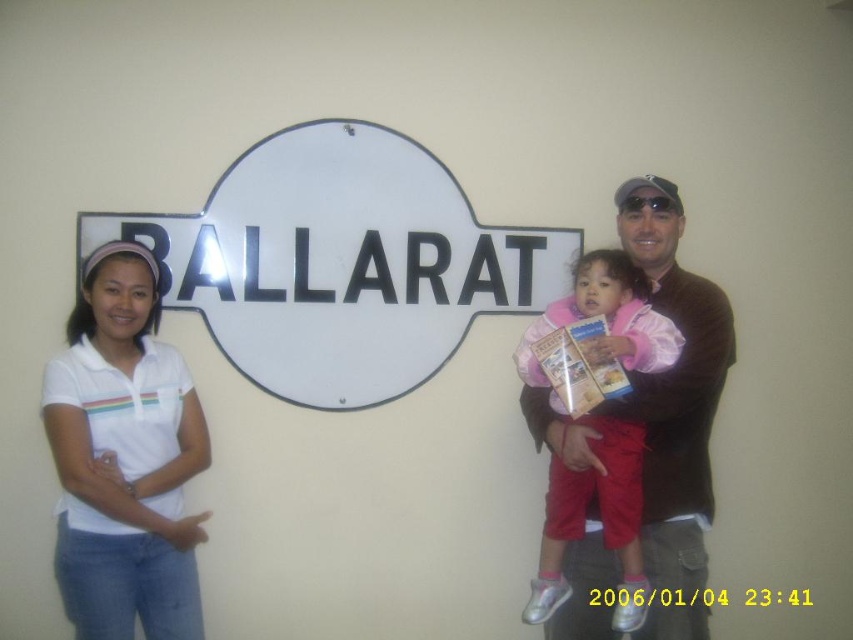
Between point (76, 544) and point (659, 458), which one is positioned behind?

The point (659, 458) is more distant.

Is point (83, 465) in front of point (642, 189)?

Yes.

This screenshot has width=853, height=640. I want to click on white cotton shirt at left, so click(125, 458).